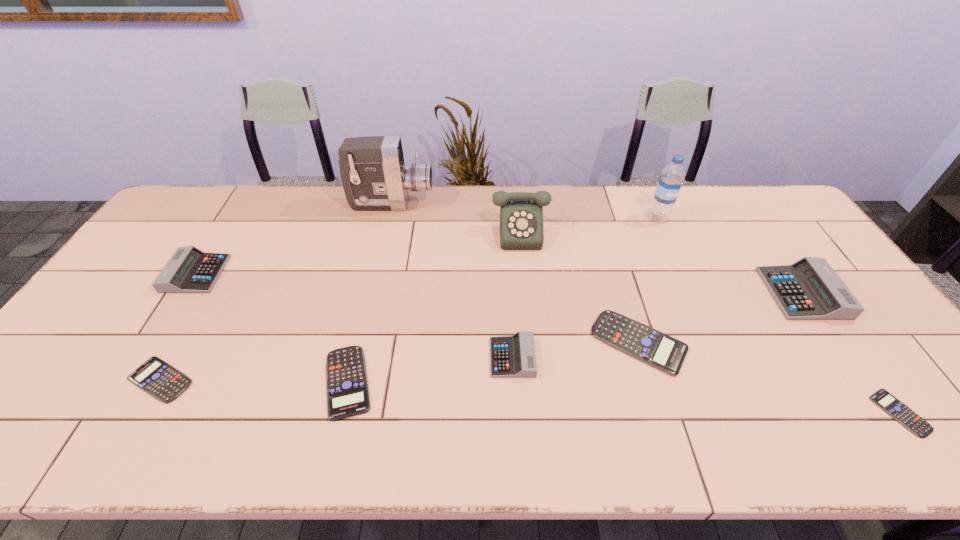
The image size is (960, 540). What are the coordinates of `gray calculator object that ranks as the closest to the third tallest object` in the screenshot? It's located at (514, 356).

At what (x,y) coordinates should I click in order to perform the action: click on gray calculator that is the third closest to the blue water bottle. Please return your answer as a coordinate pair (x, y). The height and width of the screenshot is (540, 960). Looking at the image, I should click on (190, 270).

Locate which blue calculator is the closest to the shortest object. Please provide its 2D coordinates. Your answer should be formatted as a tuple, i.e. [(x, y)], where the tuple contains the x and y coordinates of a point satisfying the conditions above.

[(661, 351)]

Locate which blue calculator ranks in proximity to the fifth tallest calculator. Please provide its 2D coordinates. Your answer should be formatted as a tuple, i.e. [(x, y)], where the tuple contains the x and y coordinates of a point satisfying the conditions above.

[(156, 377)]

Identify the location of vacant point that satisfies the following two spatial constraints: 1. on the front side of the sixth shortest calculator; 2. on the left side of the rightmost blue calculator. The width and height of the screenshot is (960, 540). (109, 413).

Where is `free space that satisfies the following two spatial constraints: 1. on the back side of the fourth shortest object; 2. at the front of the camcorder, highlighting the lens`? free space that satisfies the following two spatial constraints: 1. on the back side of the fourth shortest object; 2. at the front of the camcorder, highlighting the lens is located at coordinates (597, 204).

Locate an element on the screen. This screenshot has height=540, width=960. blank space that satisfies the following two spatial constraints: 1. at the front of the camcorder, highlighting the lens; 2. on the right side of the fourth tallest calculator is located at coordinates (360, 342).

At what (x,y) coordinates should I click in order to perform the action: click on free space in the image that satisfies the following two spatial constraints: 1. at the front of the rightmost gray calculator, highlighting the lens; 2. on the right side of the camcorder. Please return your answer as a coordinate pair (x, y). Looking at the image, I should click on (372, 293).